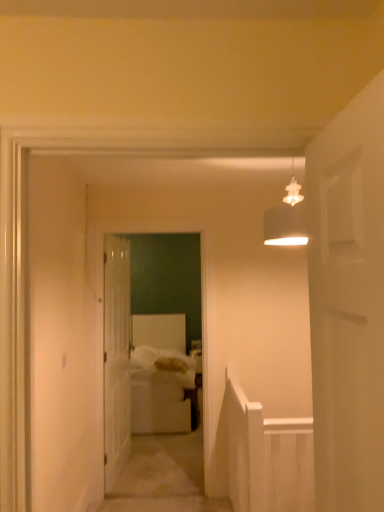
You are a GUI agent. You are given a task and a screenshot of the screen. Output one action in this format:
    pyautogui.click(x=<x>, y=<y>)
    Task: Click on the vacant space to the right of white glossy door at center
    
    Given the screenshot: What is the action you would take?
    pyautogui.click(x=152, y=468)